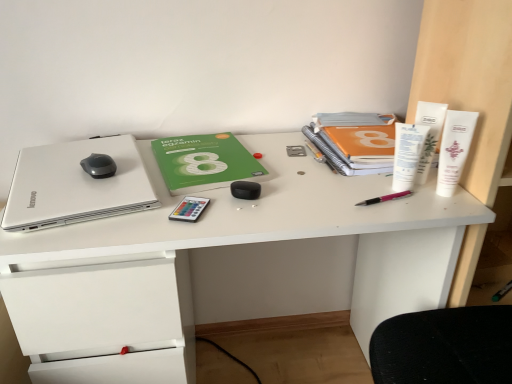
Question: From the image's perspective, is orange matte notebook at upper right, which is the 2th paperback book in left-to-right order, above or below green matte paperback book at center, which is the second paperback book in right-to-left order?

Choices:
 (A) above
 (B) below

Answer: (A)

Question: Is orange matte notebook at upper right, which is the 2th paperback book in left-to-right order, in front of or behind green matte paperback book at center, which is the second paperback book in right-to-left order, in the image?

Choices:
 (A) behind
 (B) front

Answer: (A)

Question: Estimate the real-world distances between objects in this image. Which object is farther from the white plastic tubes at right, which is the third stationery from left to right?

Choices:
 (A) white matte laptop at left
 (B) white plastic tube at upper right, which is the fifth stationery in left-to-right order
 (C) white matte desk at center
 (D) black rubberized mouse at upper left
 (E) black plastic remote control at center-left, positioned as the fifth stationery in right-to-left order

Answer: (A)

Question: Considering the real-world distances, which object is closest to the pink metallic pen at center-right, which ranks as the 4th stationery in right-to-left order?

Choices:
 (A) black rubberized mouse at upper left
 (B) white matte laptop at left
 (C) white plastic tubes at right
 (D) white plastic tube at upper right, the 2th stationery positioned from the right
 (E) green matte paperback book at center, which is the second paperback book in right-to-left order

Answer: (D)